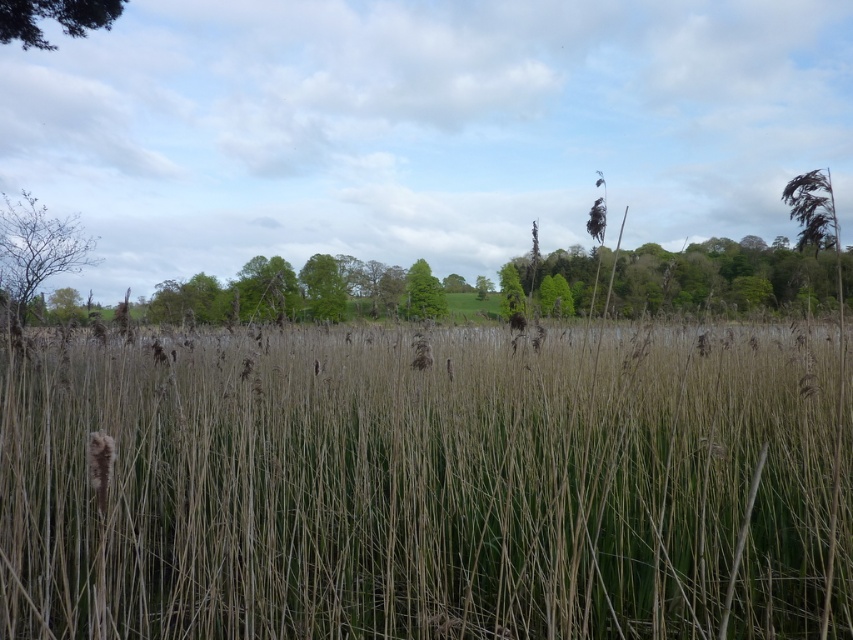
Is dry grass at center below green leafy tree at upper center?

Correct, dry grass at center is located below green leafy tree at upper center.

Which of these two, dry grass at center or green leafy tree at upper center, stands taller?

green leafy tree at upper center is taller.

Which is behind, point (254, 624) or point (614, 301)?

Positioned behind is point (614, 301).

Identify the location of dry grass at center. The width and height of the screenshot is (853, 640). (425, 486).

Which is in front, point (28, 202) or point (436, 291)?

Point (28, 202) is in front.

Which is below, bare branches at left or green matte tree at center?

bare branches at left is below.

Which is behind, point (61, 268) or point (427, 301)?

Positioned behind is point (427, 301).

The image size is (853, 640). In order to click on bare branches at left in this screenshot , I will do `click(38, 248)`.

Who is shorter, green leafy tree at upper left or green leafy tree at center?

With less height is green leafy tree at upper left.

Is green leafy tree at upper left positioned in front of green leafy tree at center?

Yes, it is.

Who is more forward, (56, 19) or (334, 300)?

Positioned in front is point (56, 19).

Where is `green leafy tree at upper left`? The width and height of the screenshot is (853, 640). green leafy tree at upper left is located at coordinates (53, 19).